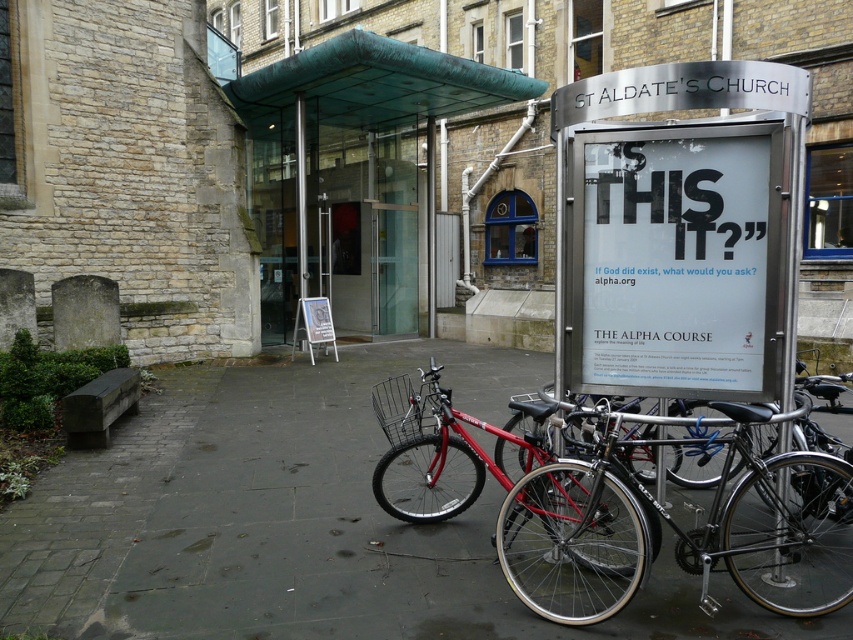
You are standing in front of St Aldate Church and want to place a new signboard. The existing signboard is at the foreground. Where should you place the new signboard so it doesn not block the paved stone pavement at center?

The paved stone pavement at center is located at point [299,522], so you should place the new signboard away from that coordinate to avoid blocking it.

You are a delivery person who needs to place a large box on the ground near the shiny black bicycle at center. Considering the paved stone pavement at center is lower than the bicycle, where should you place the box so it stays stable?

The paved stone pavement at center has a lesser height compared to the shiny black bicycle at center. To ensure stability, place the box on the higher surface, which is the shiny black bicycle at center.

You are a delivery person who needs to park your motorcycle next to the shiny red bicycle at center. Is there enough space on the paved stone pavement at center to park your motorcycle?

The paved stone pavement at center is bigger than the shiny red bicycle at center, so there is likely enough space to park the motorcycle next to the shiny red bicycle at center.